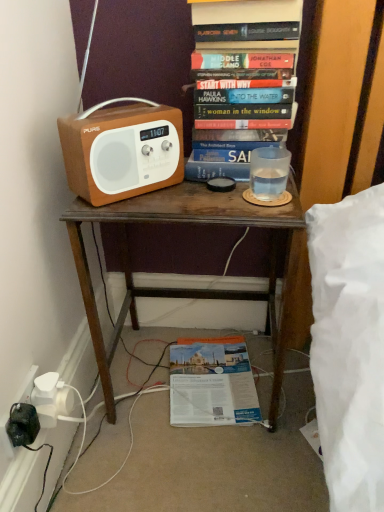
Question: In terms of height, does matte brown radio at left look taller or shorter compared to hardcover book at upper center, placed as the second book when sorted from back to front?

Choices:
 (A) tall
 (B) short

Answer: (B)

Question: Is matte brown radio at left in front of or behind hardcover book at upper center, placed as the second book when sorted from back to front, in the image?

Choices:
 (A) front
 (B) behind

Answer: (A)

Question: Which object is the closest to the matte paper magazine at lower center, placed as the 1th book when sorted from back to front?

Choices:
 (A) hardcover book at upper center, placed as the second book when sorted from back to front
 (B) matte brown radio at left
 (C) brown wooden desk at center

Answer: (C)

Question: Considering the real-world distances, which object is farthest from the hardcover book at upper center, the 2th book in the bottom-to-top sequence?

Choices:
 (A) matte paper magazine at lower center, which is the second book from top to bottom
 (B) brown wooden desk at center
 (C) matte brown radio at left

Answer: (A)